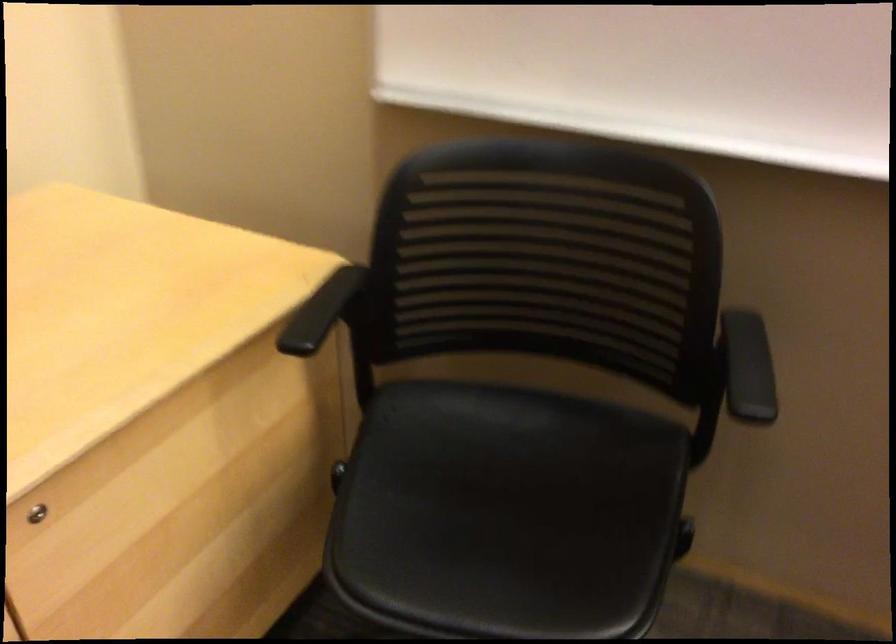
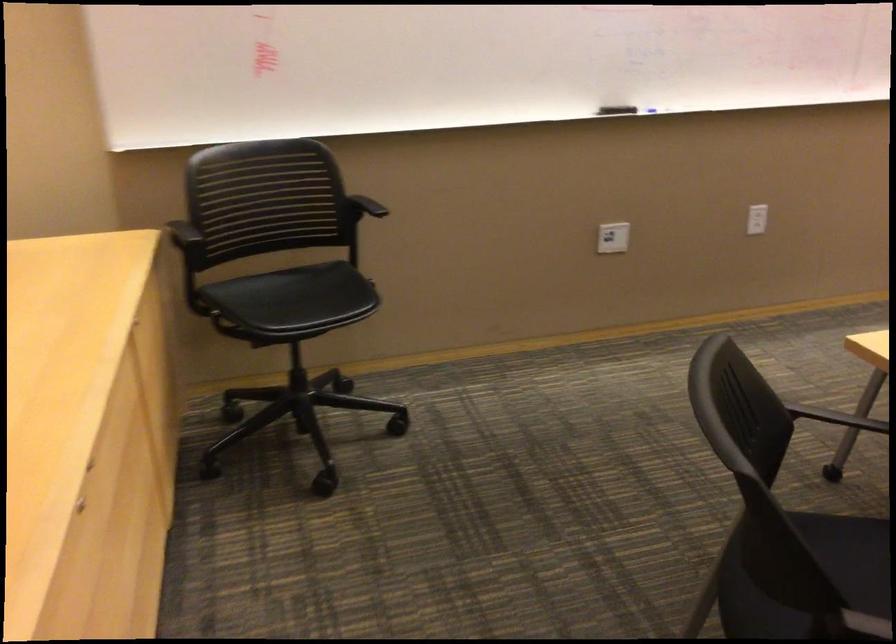
In the second image, find the point that corresponds to [747,368] in the first image.

(375, 220)